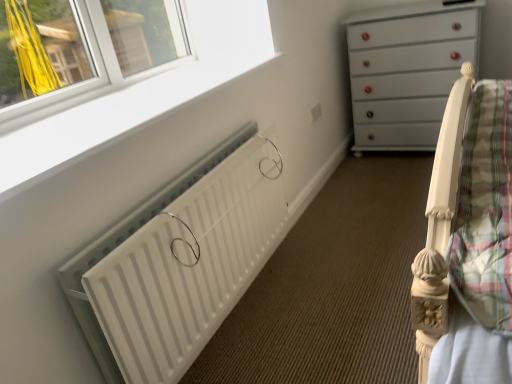
Question: Is white matte radiator at lower left aimed at white glossy chest of drawers at upper right?

Choices:
 (A) no
 (B) yes

Answer: (A)

Question: From the image's perspective, is white matte radiator at lower left over white glossy chest of drawers at upper right?

Choices:
 (A) yes
 (B) no

Answer: (B)

Question: From a real-world perspective, is white matte radiator at lower left on white glossy chest of drawers at upper right?

Choices:
 (A) yes
 (B) no

Answer: (B)

Question: Is white matte radiator at lower left facing away from white glossy chest of drawers at upper right?

Choices:
 (A) no
 (B) yes

Answer: (A)

Question: Considering the relative sizes of white matte radiator at lower left and white glossy chest of drawers at upper right in the image provided, is white matte radiator at lower left bigger than white glossy chest of drawers at upper right?

Choices:
 (A) no
 (B) yes

Answer: (A)

Question: From the image's perspective, is white plastic window frame at upper left located above or below white matte radiator at lower left?

Choices:
 (A) below
 (B) above

Answer: (B)

Question: In terms of size, does white plastic window frame at upper left appear bigger or smaller than white matte radiator at lower left?

Choices:
 (A) small
 (B) big

Answer: (A)

Question: From a real-world perspective, is white plastic window frame at upper left positioned above or below white matte radiator at lower left?

Choices:
 (A) below
 (B) above

Answer: (B)

Question: In terms of height, does white plastic window frame at upper left look taller or shorter compared to white matte radiator at lower left?

Choices:
 (A) tall
 (B) short

Answer: (B)

Question: Considering the positions of white plastic window frame at upper left and white glossy chest of drawers at upper right in the image, is white plastic window frame at upper left taller or shorter than white glossy chest of drawers at upper right?

Choices:
 (A) short
 (B) tall

Answer: (A)

Question: Relative to white glossy chest of drawers at upper right, is white plastic window frame at upper left in front or behind?

Choices:
 (A) front
 (B) behind

Answer: (A)

Question: From the image's perspective, is white plastic window frame at upper left located above or below white glossy chest of drawers at upper right?

Choices:
 (A) above
 (B) below

Answer: (B)

Question: Which is correct: white plastic window frame at upper left is inside white glossy chest of drawers at upper right, or outside of it?

Choices:
 (A) outside
 (B) inside

Answer: (A)

Question: Considering the positions of white glossy chest of drawers at upper right and white matte radiator at lower left in the image, is white glossy chest of drawers at upper right bigger or smaller than white matte radiator at lower left?

Choices:
 (A) small
 (B) big

Answer: (B)

Question: From a real-world perspective, relative to white matte radiator at lower left, is white glossy chest of drawers at upper right vertically above or below?

Choices:
 (A) above
 (B) below

Answer: (A)